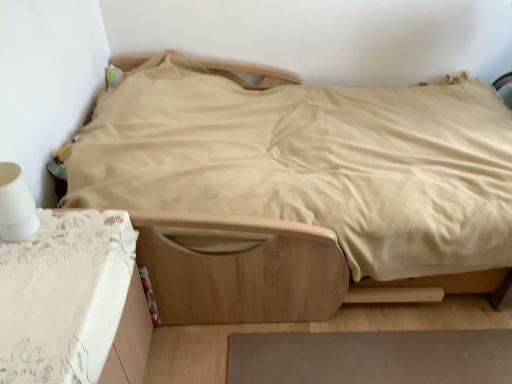
This screenshot has height=384, width=512. What are the coordinates of `free space in front of white matte table lamp at left` in the screenshot? It's located at (25, 272).